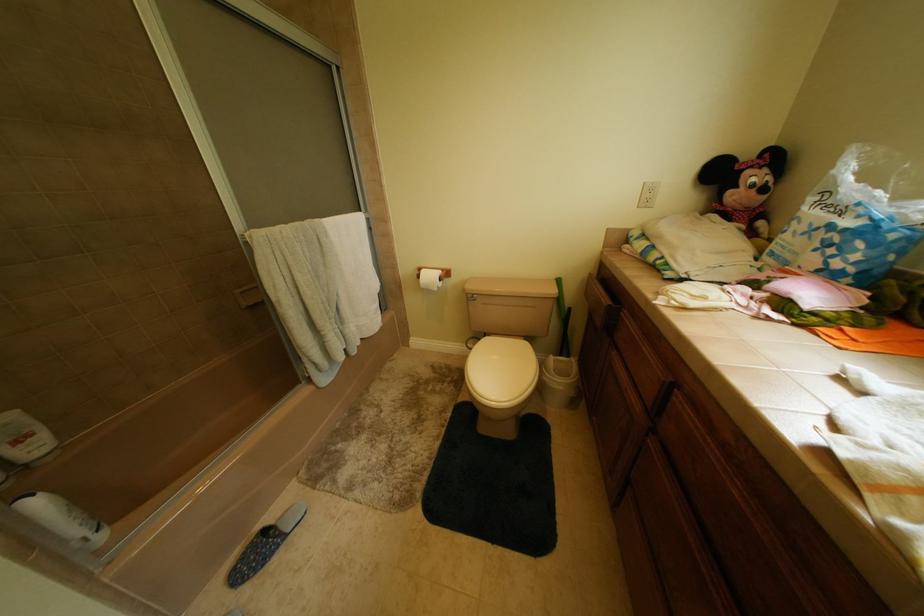
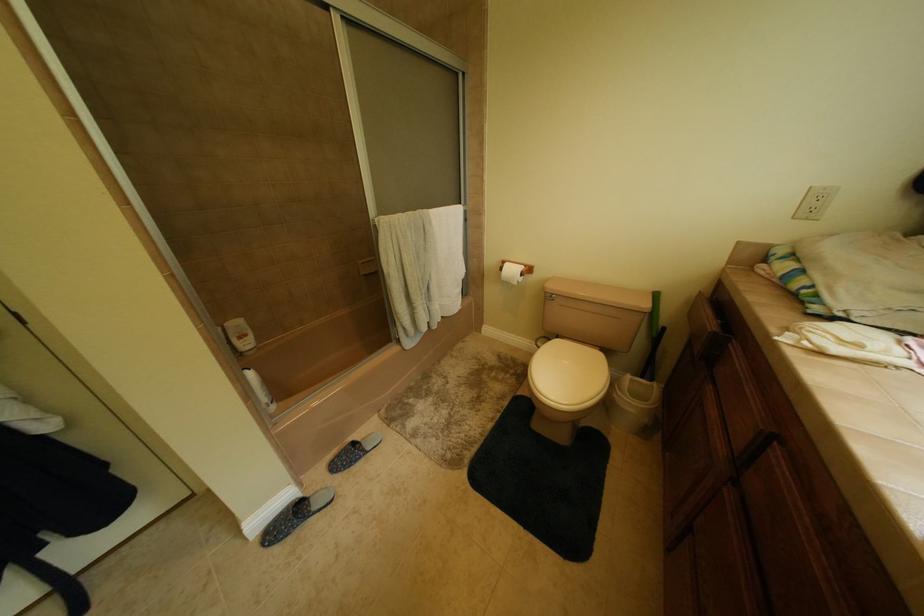
Question: The first image is from the beginning of the video and the second image is from the end. How did the camera likely rotate when shooting the video?

Choices:
 (A) Left
 (B) Right
 (C) Up
 (D) Down

Answer: (A)